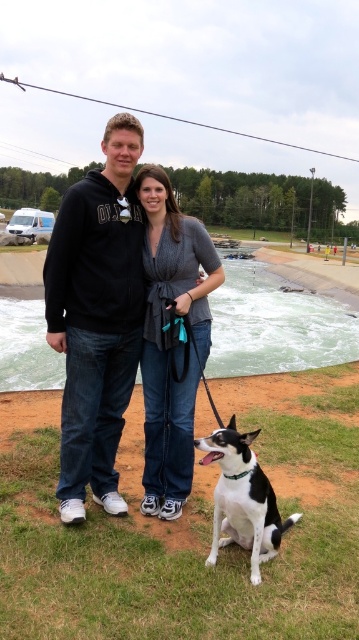
Is denim jeans at center below black hoodie at center?

Yes.

Which is below, denim jeans at center or black hoodie at center?

Positioned lower is denim jeans at center.

Where is `denim jeans at center`? denim jeans at center is located at coordinates (171, 339).

Is point (185, 237) positioned after point (241, 500)?

Yes.

Which of these two, denim jeans at center or black and white fur at lower center, stands taller?

Standing taller between the two is denim jeans at center.

Image resolution: width=359 pixels, height=640 pixels. What do you see at coordinates (171, 339) in the screenshot?
I see `denim jeans at center` at bounding box center [171, 339].

Identify the location of denim jeans at center. (171, 339).

The image size is (359, 640). What do you see at coordinates (168, 435) in the screenshot?
I see `black hoodie at center` at bounding box center [168, 435].

Measure the distance from black hoodie at center to black and white fur at lower center.

black hoodie at center and black and white fur at lower center are 24.03 inches apart.

What do you see at coordinates (168, 435) in the screenshot? Image resolution: width=359 pixels, height=640 pixels. I see `black hoodie at center` at bounding box center [168, 435].

This screenshot has height=640, width=359. I want to click on black hoodie at center, so click(x=168, y=435).